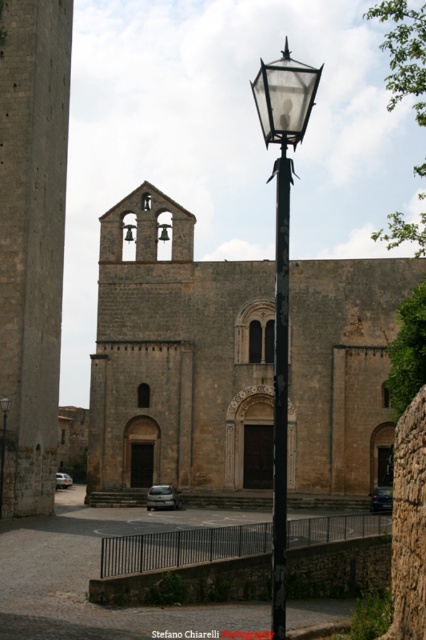
You are standing in front of the church and want to take a photo of the gray stone tower at left and the metallic gray sedan at center. Which object should you zoom in on first to ensure both are in frame?

You should zoom in on the metallic gray sedan at center first because the gray stone tower at left is taller, so zooming in on the shorter metallic gray sedan at center will help keep both in frame.